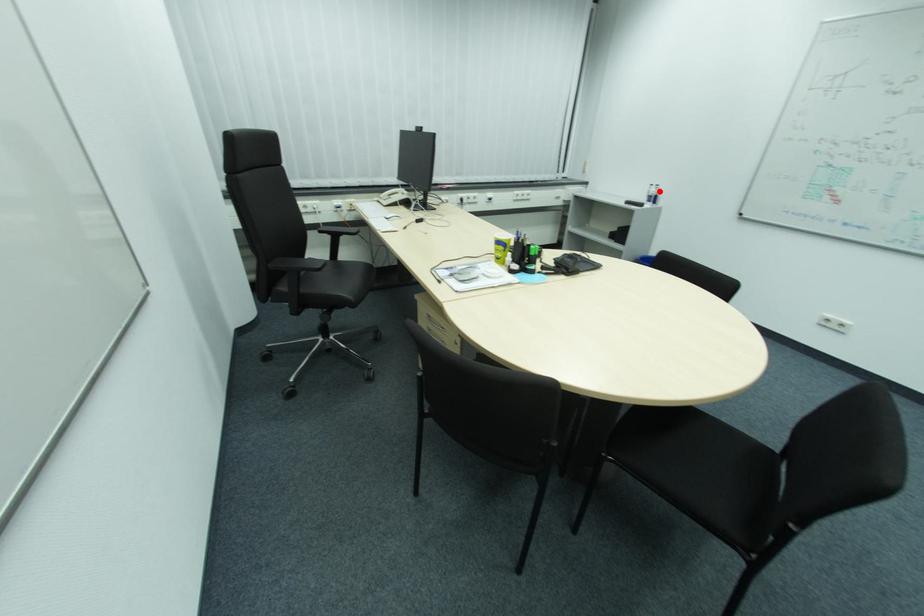
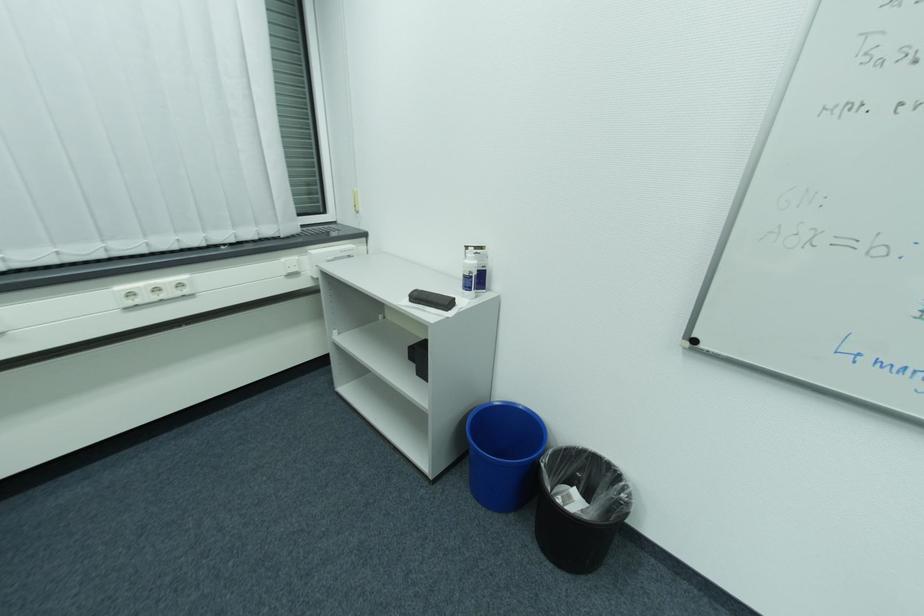
Question: I am providing you with two images of the same scene from different viewpoints. In image1, a red point is highlighted. Considering the same 3D point in image2, which of the following is correct?

Choices:
 (A) It is closer
 (B) It is farther

Answer: (B)